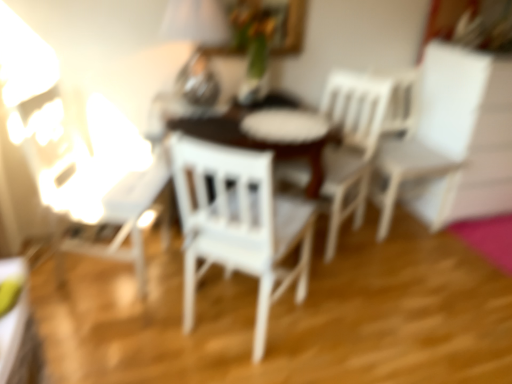
Question: In terms of height, does white wood chair at center, the 3th chair when ordered from right to left, look taller or shorter compared to white wood chair at center, the 2th chair when ordered from left to right?

Choices:
 (A) tall
 (B) short

Answer: (A)

Question: Considering the positions of white wood chair at center, which appears as the 1th chair when viewed from the left, and white wood chair at center, positioned as the second chair in right-to-left order, in the image, is white wood chair at center, which appears as the 1th chair when viewed from the left, bigger or smaller than white wood chair at center, positioned as the second chair in right-to-left order,?

Choices:
 (A) big
 (B) small

Answer: (A)

Question: Which object is positioned farthest from the white wood chair at center, which appears as the 1th chair when viewed from the left?

Choices:
 (A) metallic silver table lamp at upper center
 (B) white matte chair at right, which is counted as the first chair, starting from the right
 (C) white wood chair at center, the 2th chair when ordered from left to right

Answer: (B)

Question: Which object is the closest to the metallic silver table lamp at upper center?

Choices:
 (A) white matte chair at right, which appears as the third chair when viewed from the left
 (B) white wood chair at center, the 3th chair when ordered from right to left
 (C) white wood chair at center, positioned as the second chair in right-to-left order

Answer: (B)